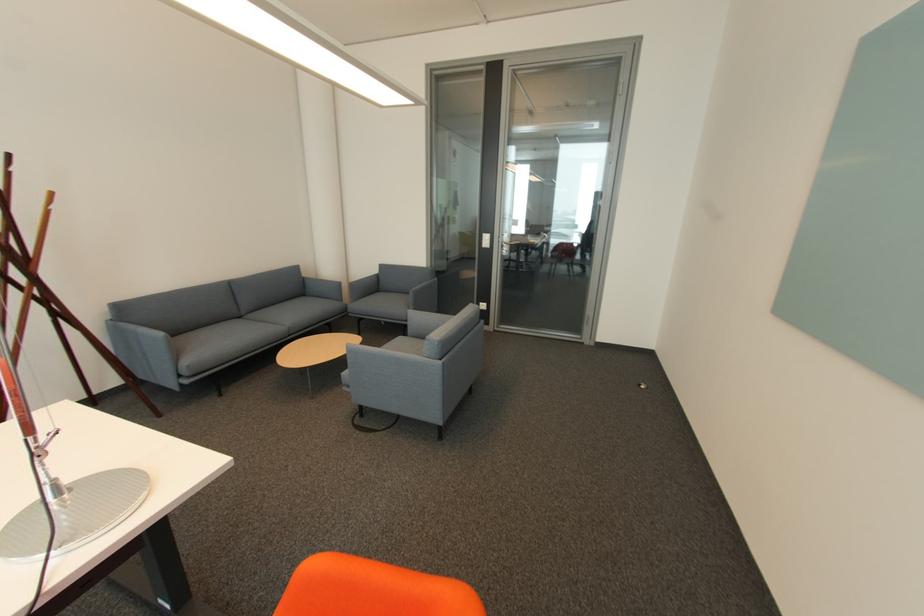
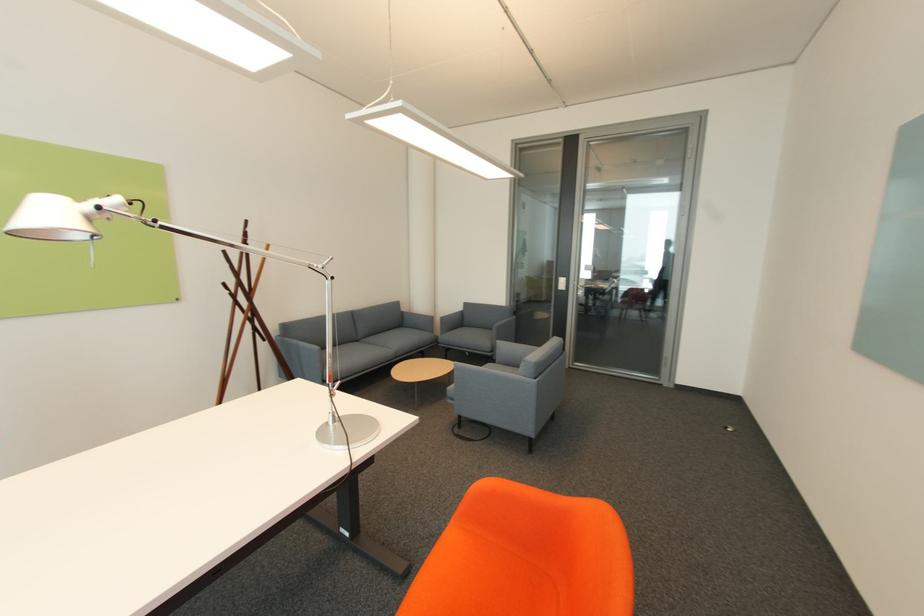
In a continuous first-person perspective shot, in which direction is the camera moving?

The cameraman walked toward left, backward.